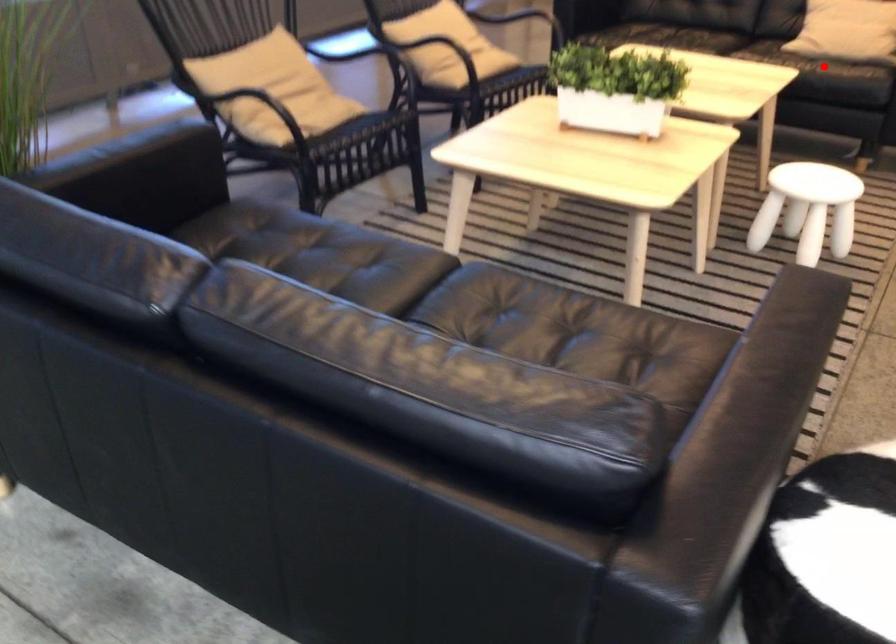
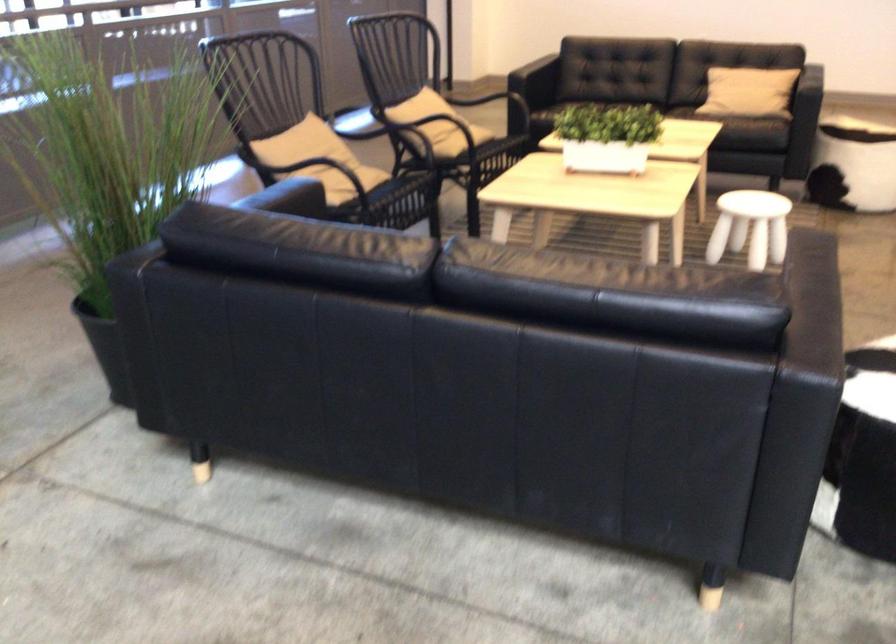
Find the pixel in the second image that matches the highlighted location in the first image.

(745, 120)